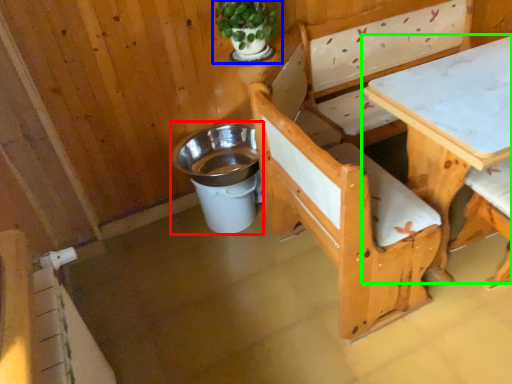
Question: Which object is positioned closest to trash bin/can (highlighted by a red box)? Select from houseplant (highlighted by a blue box) and table (highlighted by a green box).

Choices:
 (A) houseplant
 (B) table

Answer: (A)